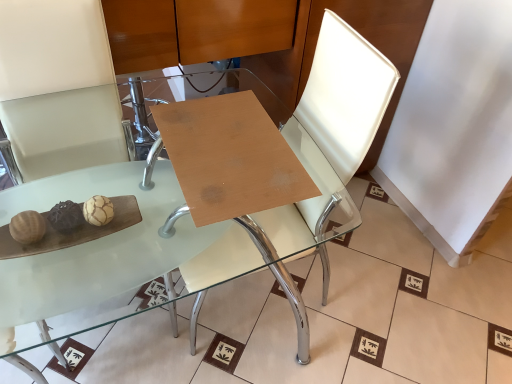
You are a GUI agent. You are given a task and a screenshot of the screen. Output one action in this format:
    pyautogui.click(x=<x>, y=<y>)
    Task: Click on the vacant space to the right of white leather swivel chair at center
    This screenshot has width=512, height=384.
    Given the screenshot: What is the action you would take?
    pyautogui.click(x=360, y=299)